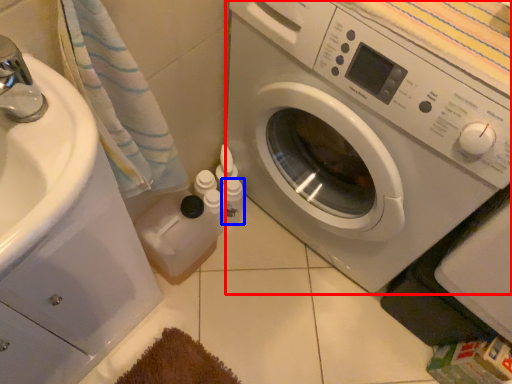
Question: Which point is further to the camera, washing machine (highlighted by a red box) or toiletry (highlighted by a blue box)?

Choices:
 (A) washing machine
 (B) toiletry

Answer: (B)